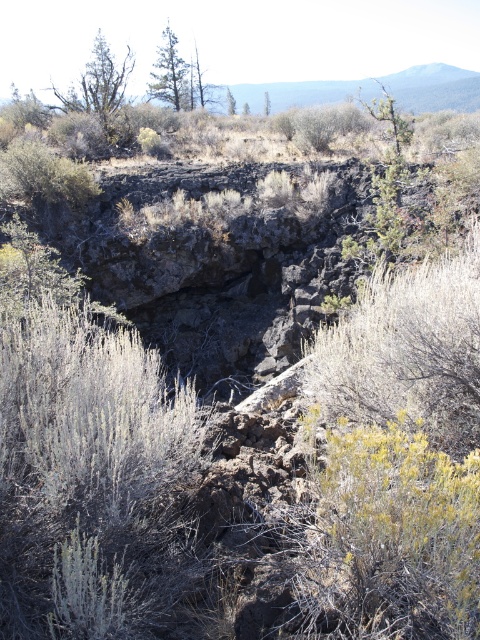
From the picture: Can you confirm if green textured tree at upper center is positioned below green leafy tree at upper center?

Correct, green textured tree at upper center is located below green leafy tree at upper center.

Describe the element at coordinates (169, 74) in the screenshot. The width and height of the screenshot is (480, 640). I see `green textured tree at upper center` at that location.

The width and height of the screenshot is (480, 640). I want to click on green textured tree at upper center, so click(169, 74).

Locate an element on the screen. This screenshot has height=640, width=480. green textured tree at upper center is located at coordinates (169, 74).

Is point (120, 76) positioned in front of point (266, 96)?

Yes, point (120, 76) is closer to viewer.

Can you confirm if green leafy tree at upper left is positioned to the left of green leafy tree at center?

Yes, green leafy tree at upper left is to the left of green leafy tree at center.

Where is `green leafy tree at upper left`? The width and height of the screenshot is (480, 640). green leafy tree at upper left is located at coordinates (99, 90).

Between point (94, 104) and point (184, 74), which one is positioned behind?

The point (184, 74) is more distant.

Is the position of green leafy tree at upper left less distant than that of green textured tree at upper center?

That is True.

Who is more forward, (113, 77) or (169, 38)?

Point (113, 77)

The height and width of the screenshot is (640, 480). I want to click on green leafy tree at upper left, so click(99, 90).